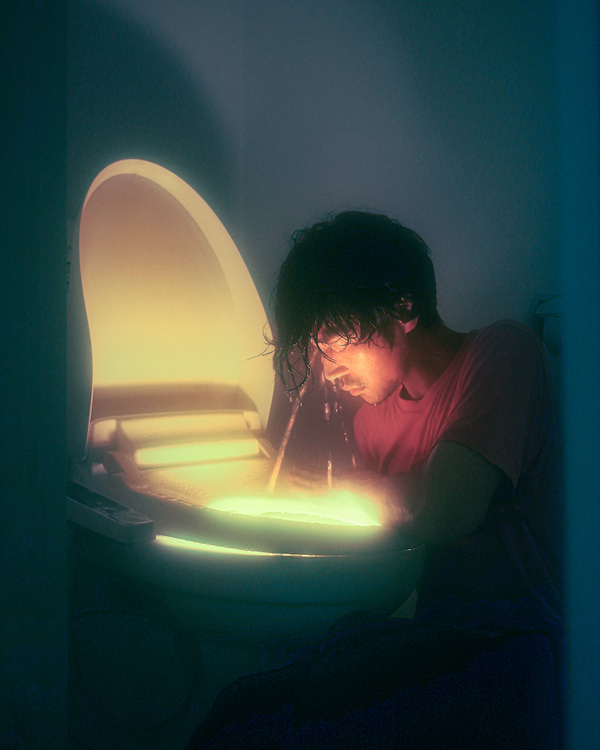
This screenshot has width=600, height=750. I want to click on bidet seat, so click(x=134, y=360).